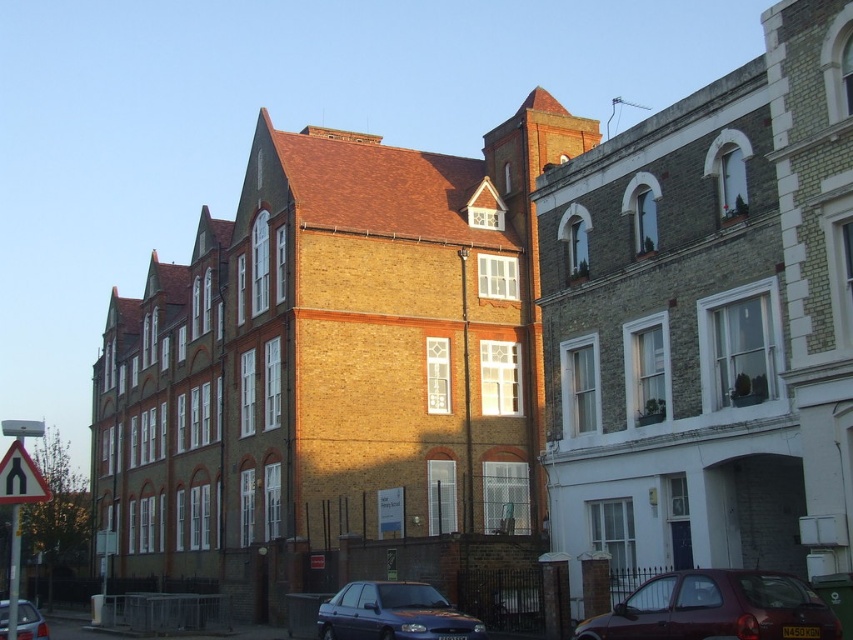
Is metallic blue sedan at lower center below metallic blue car at lower left?

Yes.

Is point (384, 627) positioned in front of point (18, 624)?

That is True.

Is point (378, 580) farther from viewer compared to point (30, 605)?

Yes, point (378, 580) is behind point (30, 605).

At what (x,y) coordinates should I click in order to perform the action: click on metallic blue sedan at lower center. Please return your answer as a coordinate pair (x, y). This screenshot has width=853, height=640. Looking at the image, I should click on pyautogui.click(x=393, y=612).

Does point (19, 515) lie in front of point (38, 614)?

That is False.

Is white plastic road sign at lower left thinner than metallic blue car at lower left?

No, white plastic road sign at lower left is not thinner than metallic blue car at lower left.

Between point (15, 605) and point (4, 634), which one is positioned behind?

The point (4, 634) is more distant.

Find the location of a particular element. white plastic road sign at lower left is located at coordinates (18, 499).

Can you confirm if metallic blue sedan at lower center is positioned to the left of white plastic road sign at lower left?

No, metallic blue sedan at lower center is not to the left of white plastic road sign at lower left.

Who is positioned more to the left, metallic blue sedan at lower center or white plastic road sign at lower left?

From the viewer's perspective, white plastic road sign at lower left appears more on the left side.

Does point (410, 588) lie in front of point (9, 472)?

No, (410, 588) is behind (9, 472).

Locate an element on the screen. The width and height of the screenshot is (853, 640). metallic blue sedan at lower center is located at coordinates tap(393, 612).